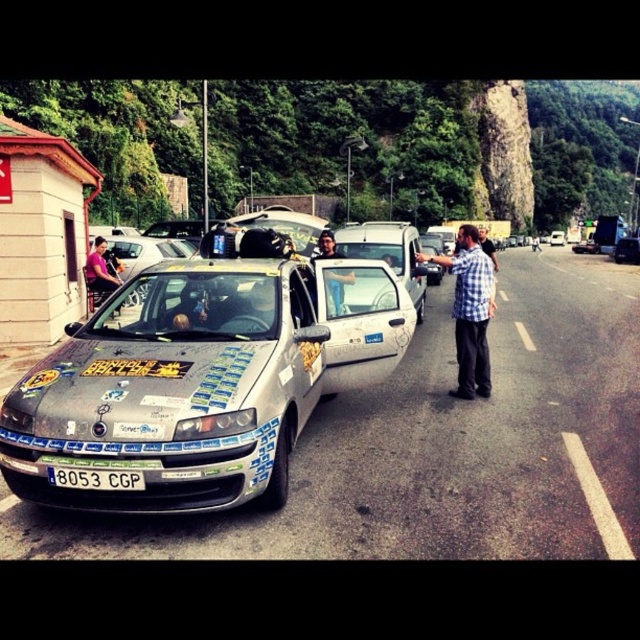
Is point (378, 296) farther from viewer compared to point (109, 484)?

Yes.

Does scratched metallic taxi at left have a lesser height compared to white plastic license plate at center?

No.

Between point (54, 502) and point (83, 488), which one is positioned behind?

The point (54, 502) is more distant.

Where is `scratched metallic taxi at left`? Image resolution: width=640 pixels, height=640 pixels. scratched metallic taxi at left is located at coordinates (198, 380).

Between scratched metallic taxi at left and white matte van at center, which one appears on the left side from the viewer's perspective?

scratched metallic taxi at left

Consider the image. Is scratched metallic taxi at left positioned before white matte van at center?

Yes, it is.

Locate an element on the screen. The width and height of the screenshot is (640, 640). scratched metallic taxi at left is located at coordinates (198, 380).

Consider the image. Is matte black shirt at left bigger than shiny silver car at center?

Actually, matte black shirt at left might be smaller than shiny silver car at center.

Is the position of matte black shirt at left less distant than that of shiny silver car at center?

Yes, matte black shirt at left is in front of shiny silver car at center.

The height and width of the screenshot is (640, 640). Describe the element at coordinates (99, 273) in the screenshot. I see `matte black shirt at left` at that location.

Where is `matte black shirt at left`? The width and height of the screenshot is (640, 640). matte black shirt at left is located at coordinates (99, 273).